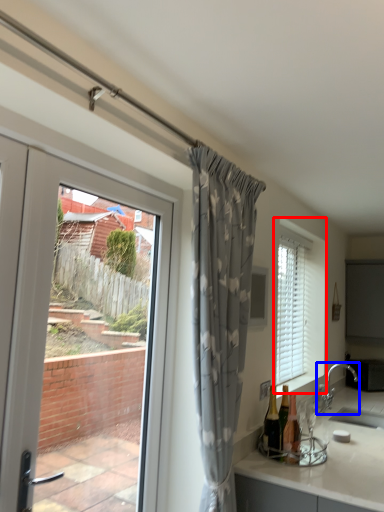
Question: Which object is closer to the camera taking this photo, window (highlighted by a red box) or tap (highlighted by a blue box)?

Choices:
 (A) window
 (B) tap

Answer: (A)